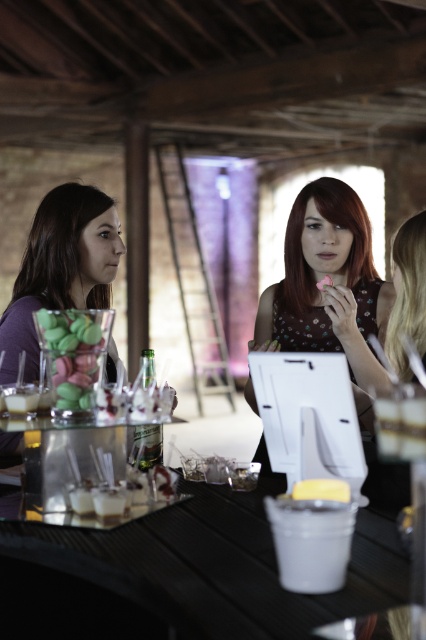
Question: Can you confirm if black textured table at center is smaller than clear glass bottle at center?

Choices:
 (A) yes
 (B) no

Answer: (B)

Question: Based on their relative distances, which object is nearer to the matte floral dress at center?

Choices:
 (A) black textured table at center
 (B) yellow matte cake at center
 (C) matte glass jar at center

Answer: (A)

Question: Does black textured table at center have a smaller size compared to matte floral dress at center?

Choices:
 (A) yes
 (B) no

Answer: (A)

Question: Which of the following is the closest to the observer?

Choices:
 (A) clear glass bottle at center
 (B) matte purple shirt at left
 (C) matte glass jar at center

Answer: (A)

Question: Which object appears farthest from the camera in this image?

Choices:
 (A) clear glass bottle at center
 (B) yellow matte cake at center
 (C) matte purple shirt at left
 (D) black textured table at center

Answer: (C)

Question: Can you confirm if matte glass jar at center is positioned to the right of yellow matte cake at center?

Choices:
 (A) no
 (B) yes

Answer: (A)